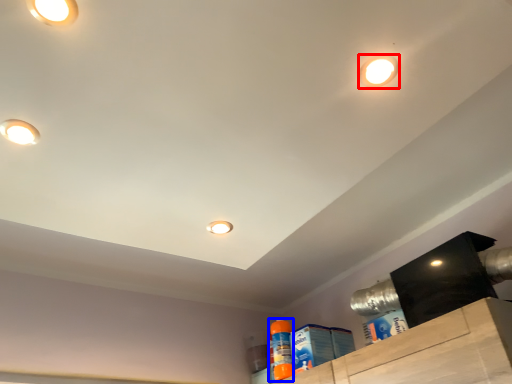
Question: Which of the following is the closest to the observer, droplight (highlighted by a red box) or cleaning product (highlighted by a blue box)?

Choices:
 (A) droplight
 (B) cleaning product

Answer: (A)